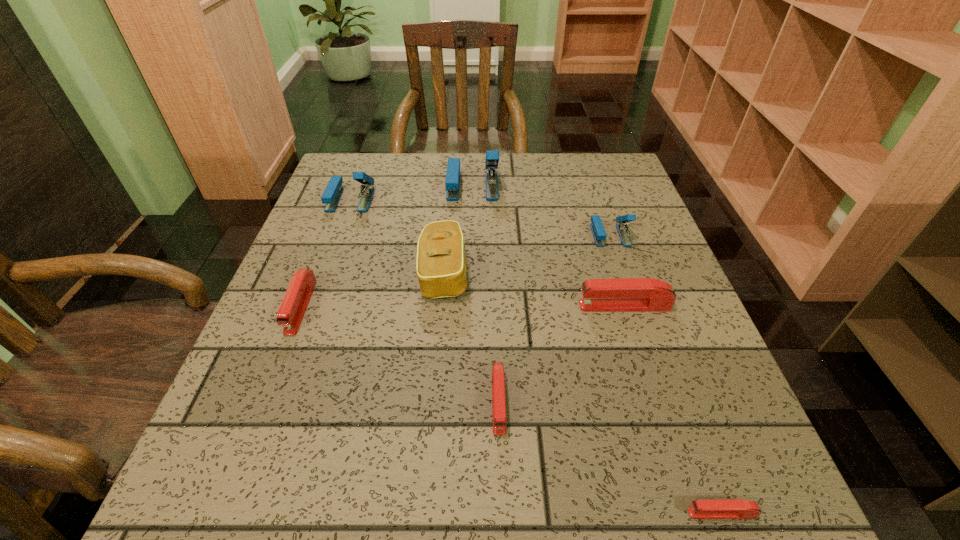
In the image, there is a desktop. Where is `vacant region at the left edge`? The height and width of the screenshot is (540, 960). vacant region at the left edge is located at coordinates (352, 226).

In the image, there is a desktop. Where is `vacant space at the right edge`? Image resolution: width=960 pixels, height=540 pixels. vacant space at the right edge is located at coordinates (655, 326).

In the image, there is a desktop. Find the location of `vacant area at the far right corner`. vacant area at the far right corner is located at coordinates (621, 170).

This screenshot has width=960, height=540. Find the location of `vacant area that lies between the second nearest red stapler and the biggest red stapler`. vacant area that lies between the second nearest red stapler and the biggest red stapler is located at coordinates (562, 354).

I want to click on vacant region between the tallest object and the smallest red stapler, so point(597,349).

This screenshot has width=960, height=540. I want to click on free space between the second blue stapler from right to left and the second nearest object, so click(x=486, y=293).

You are a GUI agent. You are given a task and a screenshot of the screen. Output one action in this format:
    pyautogui.click(x=<x>, y=<y>)
    Task: Click on the free spot between the sixth tallest object and the biggest blue stapler
    
    Given the screenshot: What is the action you would take?
    pyautogui.click(x=387, y=246)

This screenshot has width=960, height=540. I want to click on vacant region between the clutch bag and the seventh tallest object, so click(471, 337).

At what (x,y) coordinates should I click in order to perform the action: click on free point between the biggest red stapler and the nearest blue stapler. Please return your answer as a coordinate pair (x, y). The width and height of the screenshot is (960, 540). Looking at the image, I should click on (617, 271).

Where is `vacant point located between the clutch bag and the nearest blue stapler`? The height and width of the screenshot is (540, 960). vacant point located between the clutch bag and the nearest blue stapler is located at coordinates (527, 254).